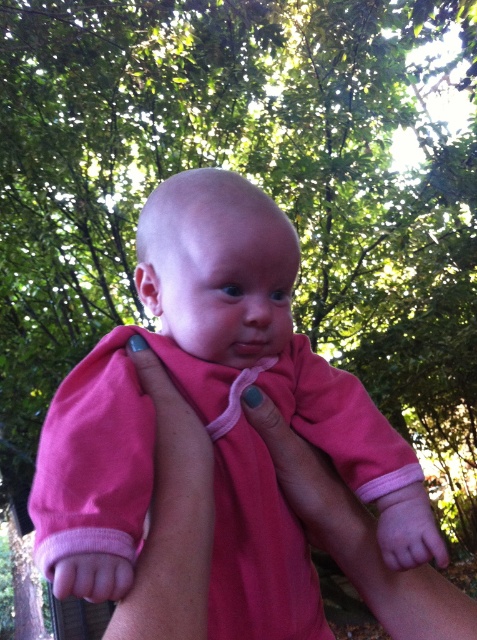
Question: Is pink fabric at center positioned in front of pink fabric hand at lower left?

Choices:
 (A) no
 (B) yes

Answer: (A)

Question: Which point appears farthest from the camera in this image?

Choices:
 (A) (286, 608)
 (B) (269, 428)
 (C) (64, 566)
 (D) (145, 368)

Answer: (B)

Question: Which object appears closest to the camera in this image?

Choices:
 (A) pink soft fabric baby at center
 (B) pink fabric hand at lower left
 (C) pink fabric at center
 (D) pink fabric hand at lower center

Answer: (B)

Question: Does pink soft fabric baby at center have a larger size compared to pink fabric hand at lower center?

Choices:
 (A) no
 (B) yes

Answer: (B)

Question: Can you confirm if pink soft fabric arm at center is bigger than pink fabric hand at lower left?

Choices:
 (A) no
 (B) yes

Answer: (B)

Question: Which object is closer to the camera taking this photo?

Choices:
 (A) pink fabric hand at lower left
 (B) pink soft fabric arm at center

Answer: (A)